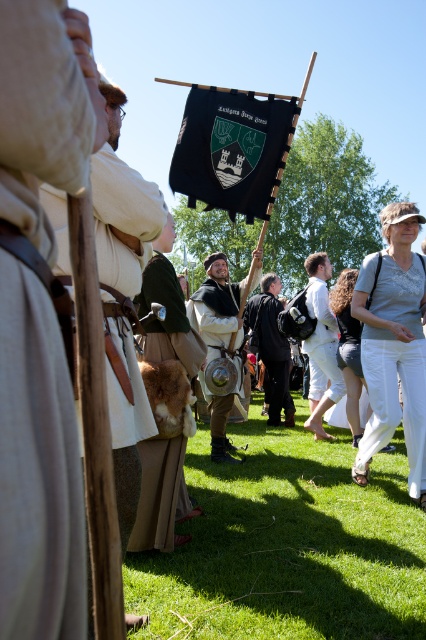
Question: Which point appears closest to the camera in this image?

Choices:
 (A) (40, 593)
 (B) (155, 493)
 (C) (245, 328)
 (D) (127, 627)

Answer: (A)

Question: Is brown fur bag at center above matte brown leather armor at center?

Choices:
 (A) yes
 (B) no

Answer: (B)

Question: Does white linen tunic at left have a smaller size compared to white cotton shirt at center?

Choices:
 (A) no
 (B) yes

Answer: (B)

Question: Which object is farther from the camera taking this photo?

Choices:
 (A) white cotton pants at lower right
 (B) brown fur bag at center
 (C) black leather armor at center

Answer: (C)

Question: Estimate the real-world distances between objects in this image. Which object is closer to the matte brown leather armor at center?

Choices:
 (A) green grass at lower center
 (B) brown fur bag at center
 (C) light beige fabric at left

Answer: (A)

Question: Observing the image, what is the correct spatial positioning of green grass at lower center in reference to white cotton shirt at center?

Choices:
 (A) right
 (B) left

Answer: (B)